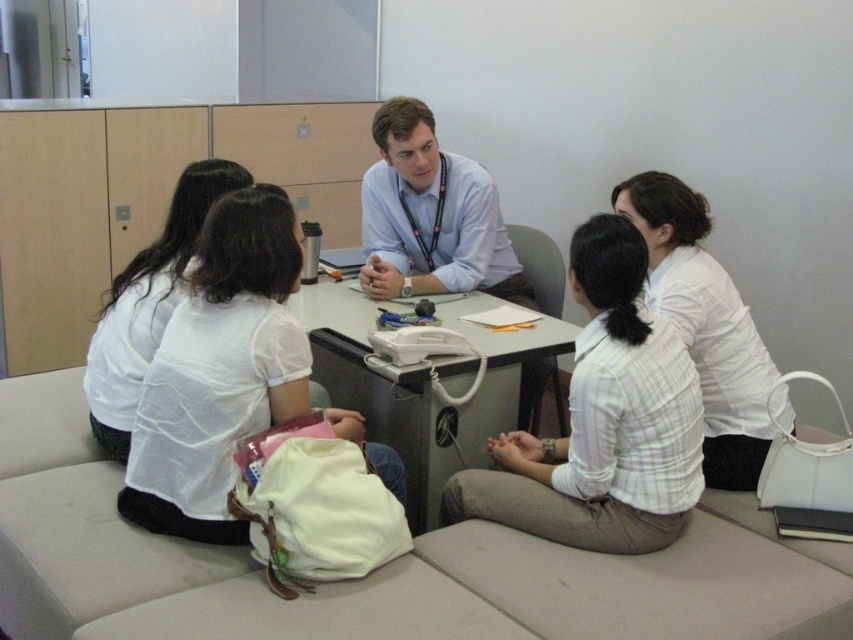
You are an office worker who needs to place a new document on the white plastic table at center. From your current position near the white fabric shirt at left, in which direction should you move to reach the table?

The white plastic table at center is to the right of the white fabric shirt at left, so you should move to your right to reach the table.

You are a photographer standing in the office scene. You need to take a photo of both the white checkered shirt at center and the blue shirt at center. Which shirt should you focus on first to ensure it appears larger in the photo?

The white checkered shirt at center is taller than the blue shirt at center, so you should focus on the white checkered shirt at center first to ensure it appears larger in the photo.

You are standing at the entrance of the office and see the point marked at coordinates (x=427, y=387). What object is located at that point?

The white plastic table at center is located at point (x=427, y=387).